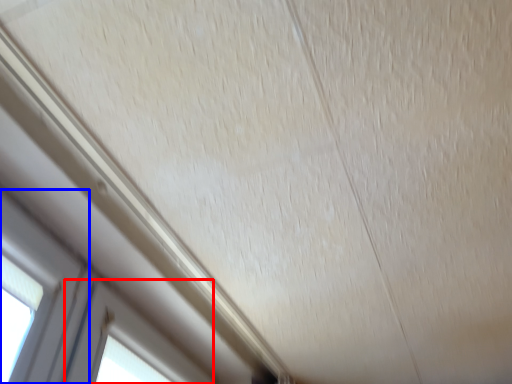
Question: Which of the following is the farthest to the observer, window (highlighted by a red box) or window (highlighted by a blue box)?

Choices:
 (A) window
 (B) window

Answer: (A)